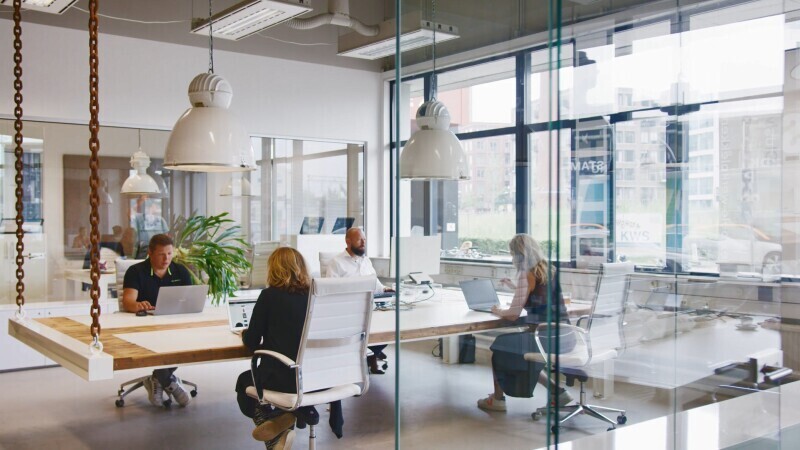
Locate an element on the screen. office chairs is located at coordinates tap(318, 330), tap(606, 292), tap(328, 254), tap(122, 266), tap(105, 258).